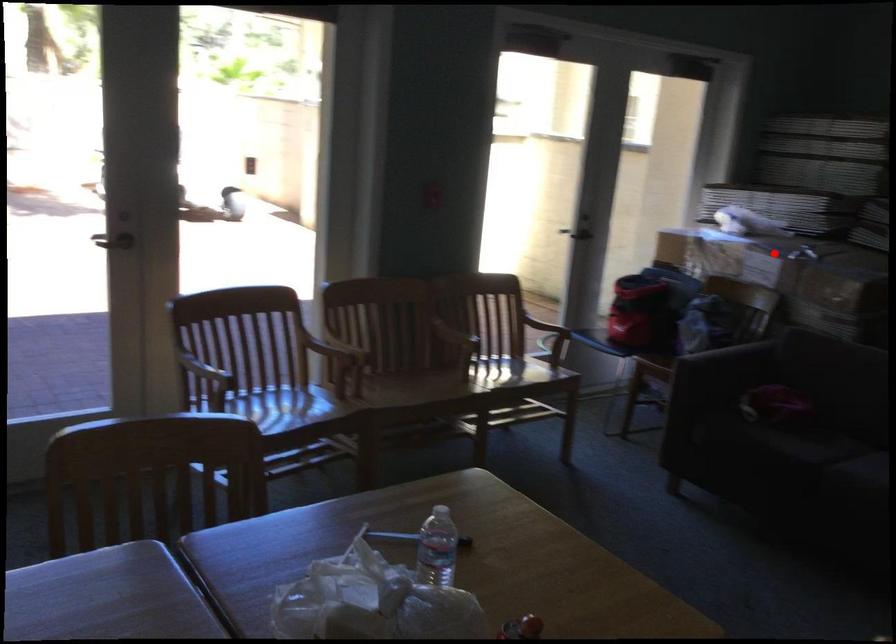
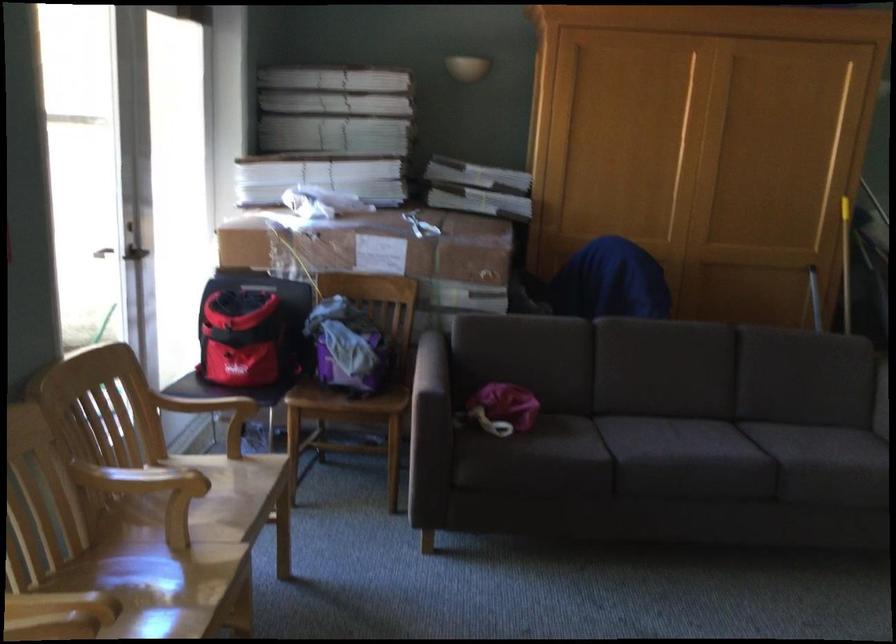
Find the pixel in the second image that matches the highlighted location in the first image.

(371, 245)